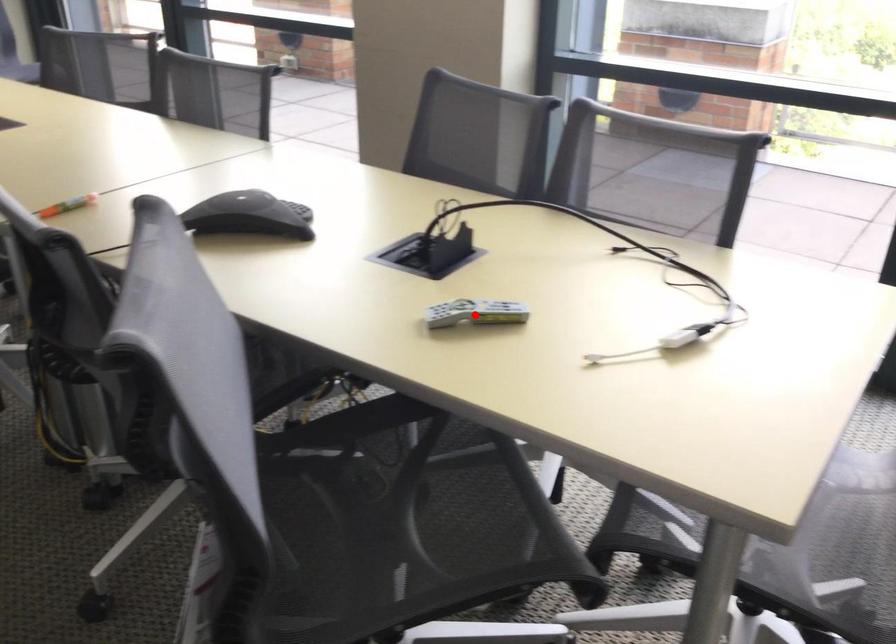
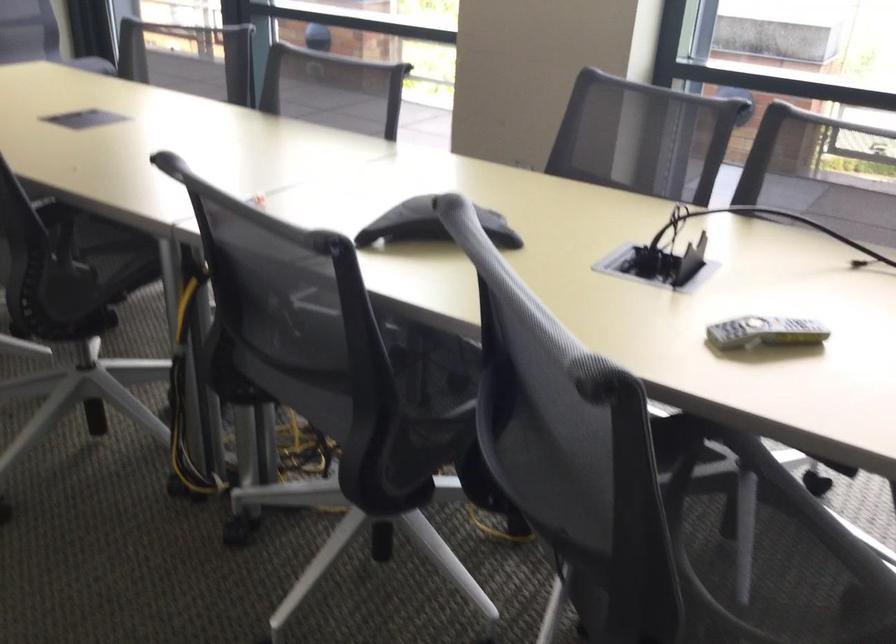
The point at the highlighted location is marked in the first image. Where is the corresponding point in the second image?

(764, 332)